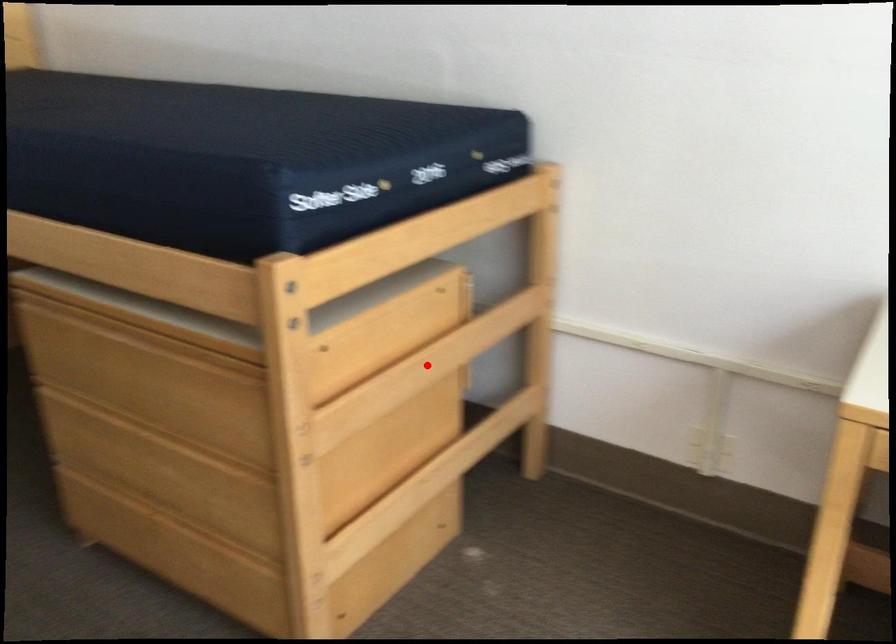
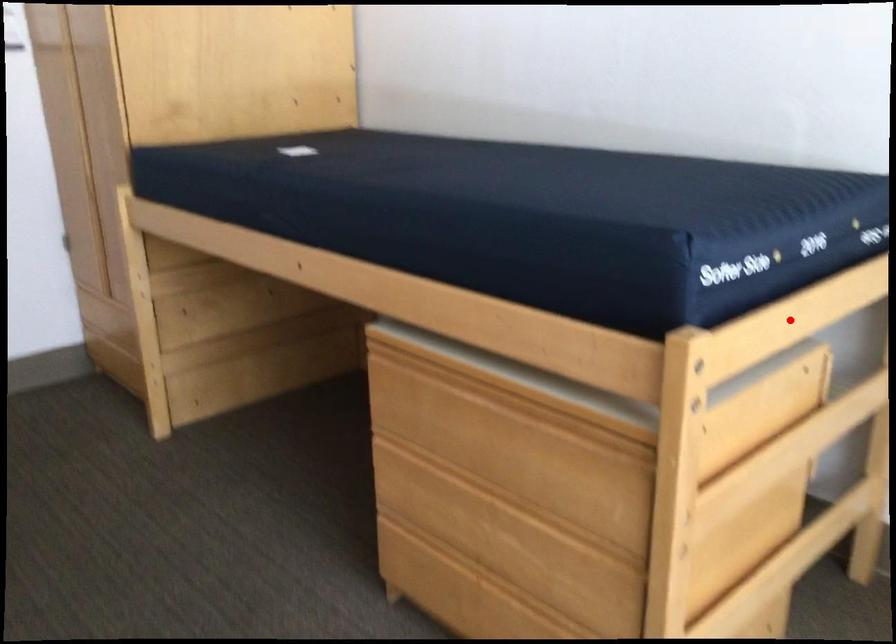
I am providing you with two images of the same scene from different viewpoints. A red point is marked on the first image and another point is marked on the second image. Is the marked point in image1 the same physical position as the marked point in image2?

No